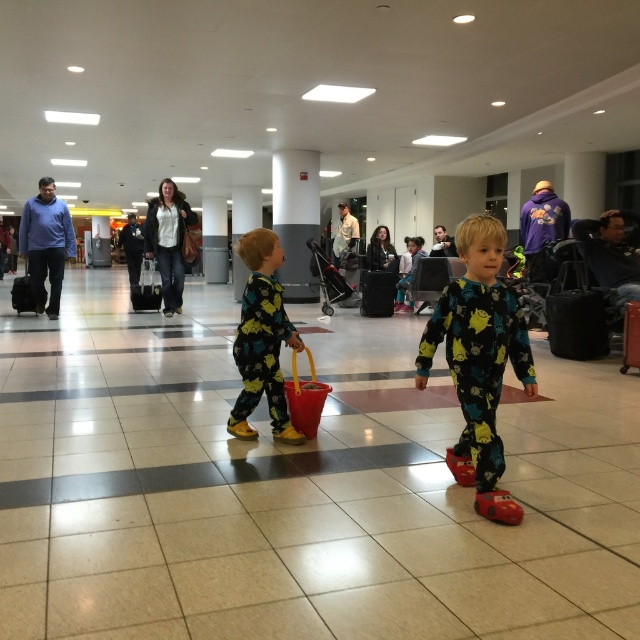
You are a traveler who needs to pack both the printed fabric pajamas at center and the black hardshell suitcase at left into a luggage compartment. Which item will take up more space in the compartment?

The printed fabric pajamas at center will take up more space in the luggage compartment because their width is larger than the black hardshell suitcase at left.

You are a traveler who just arrived at the airport terminal. You see the black fabric suitcase at right and the black matte suitcase at center. Which one is closer to you?

The black fabric suitcase at right is closer to you because it is in front of the black matte suitcase at center.